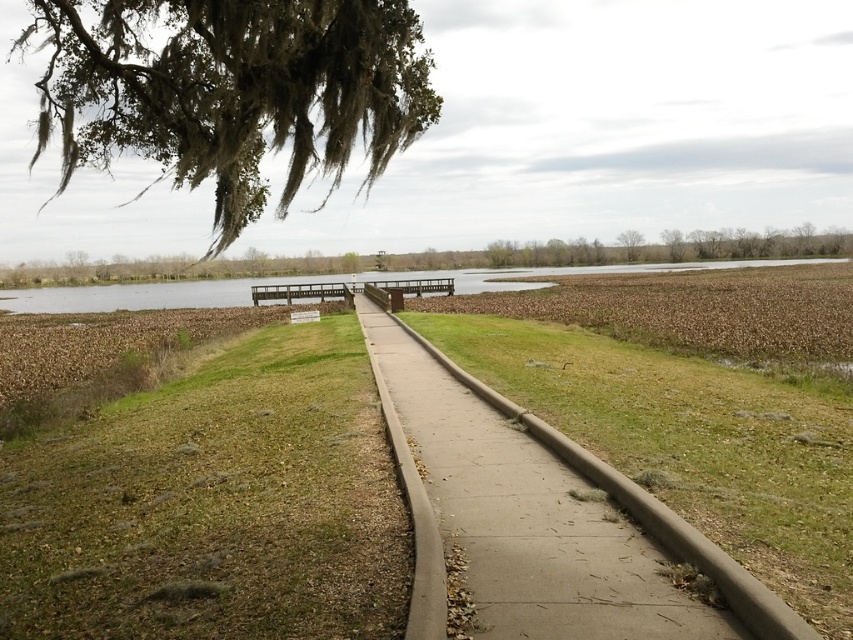
Can you confirm if green mossy branches at upper left is positioned to the right of concrete at center?

No, green mossy branches at upper left is not to the right of concrete at center.

Describe the element at coordinates (230, 90) in the screenshot. I see `green mossy branches at upper left` at that location.

What do you see at coordinates (230, 90) in the screenshot?
I see `green mossy branches at upper left` at bounding box center [230, 90].

Locate an element on the screen. The height and width of the screenshot is (640, 853). green mossy branches at upper left is located at coordinates (230, 90).

Can you confirm if concrete sidewalk at center is positioned above green mossy branches at upper left?

No.

Does concrete sidewalk at center appear on the left side of green mossy branches at upper left?

Incorrect, concrete sidewalk at center is not on the left side of green mossy branches at upper left.

Identify the location of concrete sidewalk at center. (213, 502).

Is green grass at center in front of concrete at center?

That is False.

Can you confirm if green grass at center is positioned above concrete at center?

No.

What do you see at coordinates (213, 504) in the screenshot?
I see `green grass at center` at bounding box center [213, 504].

The height and width of the screenshot is (640, 853). Find the location of `green grass at center`. green grass at center is located at coordinates (213, 504).